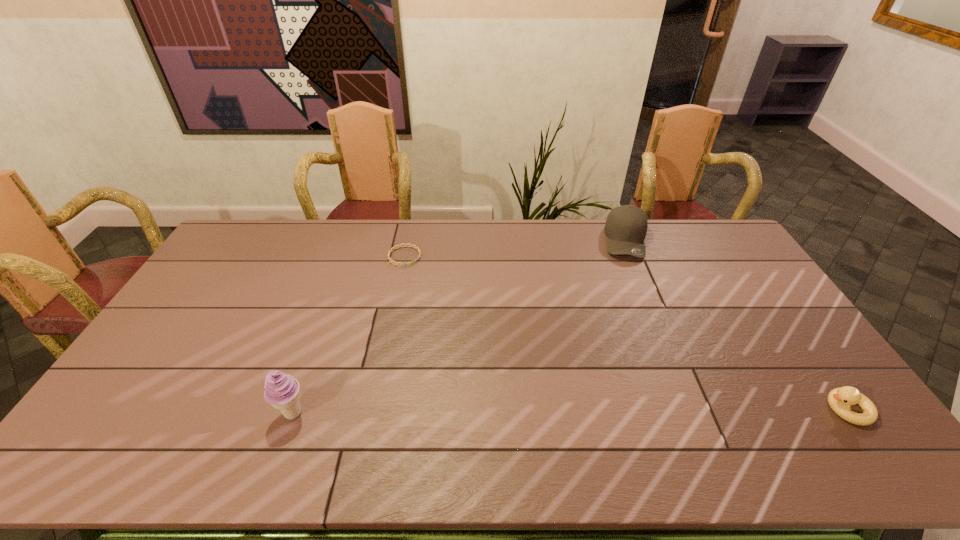
Identify the location of empty space that is in between the duckling and the second object from left to right. (626, 333).

Locate an element on the screen. vacant area that lies between the second tallest object and the rightmost object is located at coordinates (736, 325).

Where is `free spot between the icecream and the bracelet`? The height and width of the screenshot is (540, 960). free spot between the icecream and the bracelet is located at coordinates pos(348,335).

You are a GUI agent. You are given a task and a screenshot of the screen. Output one action in this format:
    pyautogui.click(x=<x>, y=<y>)
    Task: Click on the vacant point located between the bracelet and the baseball cap
    The width and height of the screenshot is (960, 540).
    Given the screenshot: What is the action you would take?
    pyautogui.click(x=516, y=248)

I want to click on vacant region between the baseball cap and the shortest object, so click(x=516, y=248).

Identify the location of empty space that is in between the duckling and the shortest object. This screenshot has height=540, width=960. (626, 333).

The height and width of the screenshot is (540, 960). What are the coordinates of `free space between the rightmost object and the icecream` in the screenshot? It's located at (569, 411).

Locate an element on the screen. blank region between the third tallest object and the baseball cap is located at coordinates (736, 325).

Locate which object is the second closest to the rightmost object. Please provide its 2D coordinates. Your answer should be formatted as a tuple, i.e. [(x, y)], where the tuple contains the x and y coordinates of a point satisfying the conditions above.

[(394, 248)]

This screenshot has height=540, width=960. I want to click on object that is the second closest one to the rightmost object, so click(x=394, y=248).